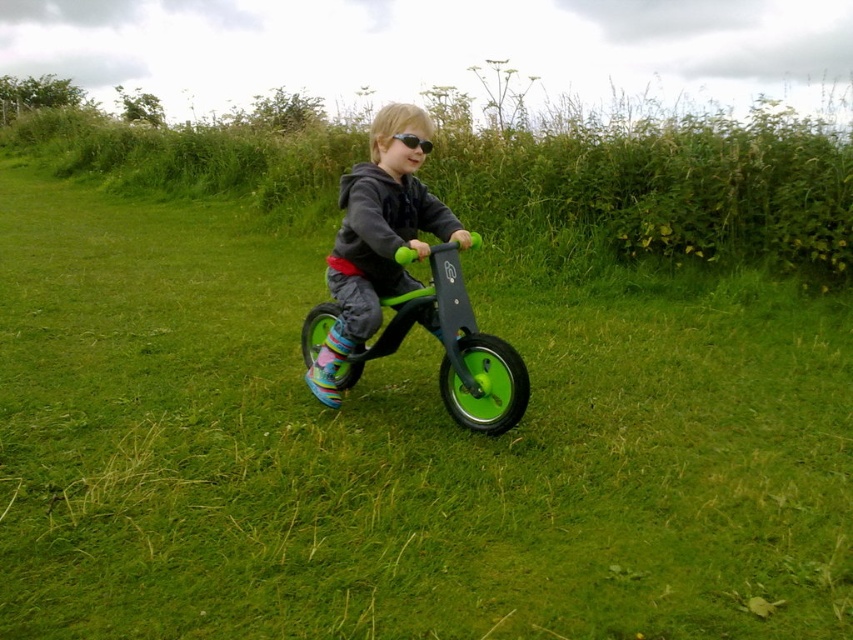
Question: Among these points, which one is nearest to the camera?

Choices:
 (A) (444, 227)
 (B) (421, 144)

Answer: (B)

Question: Is matte green bicycle at center above green rubber bicycle at center?

Choices:
 (A) yes
 (B) no

Answer: (A)

Question: Which object is farther from the camera taking this photo?

Choices:
 (A) green rubber bicycle at center
 (B) matte green bicycle at center

Answer: (B)

Question: Is green rubber bicycle at center thinner than black matte goggles at center?

Choices:
 (A) no
 (B) yes

Answer: (A)

Question: Is matte green bicycle at center above black matte goggles at center?

Choices:
 (A) yes
 (B) no

Answer: (B)

Question: Which point is closer to the camera?

Choices:
 (A) (341, 285)
 (B) (404, 141)
 (C) (432, 300)

Answer: (B)